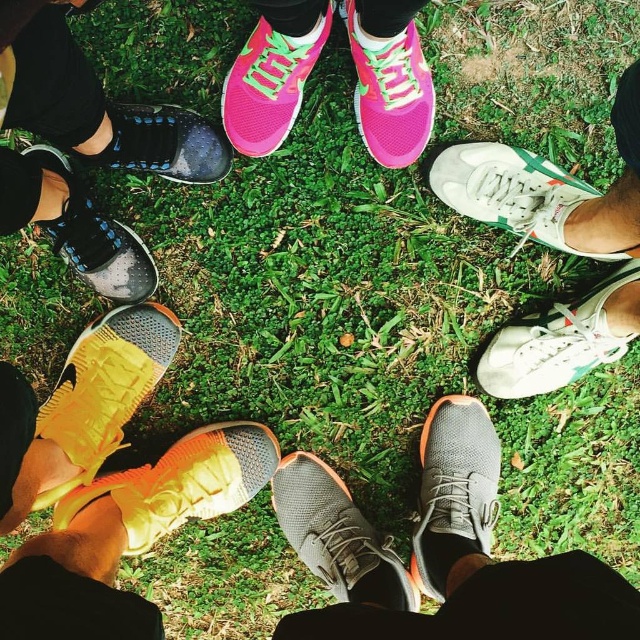
You are standing at the center of the group of people in the grassy area. You notice a point marked at coordinates (96, 237). Which object is located at this point?

The point at coordinates (96, 237) indicates the location of the matte black shoe at lower left.

You are standing in the center of the circle of people with sneakers. You need to move to a specific location. Which point, point (490, 424) or point (44, 166), is closer to you?

Point (44, 166) is closer to you because it is in front of point (490, 424).